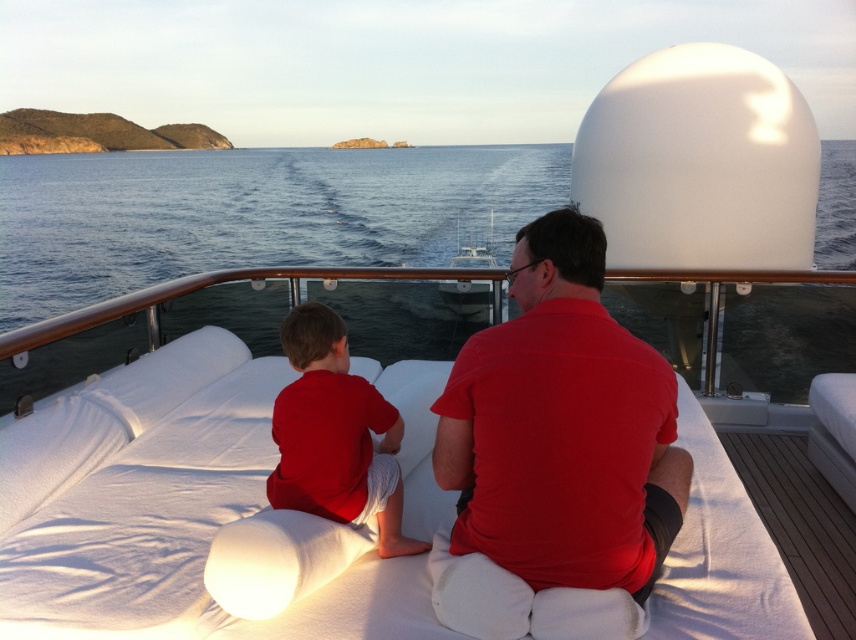
You are standing on the deck of the boat and want to take a photo. You notice two points marked on the deck at coordinates point (500, 616) and point (745, 445). Which point will appear larger in your photo?

Point (500, 616) is closer to the camera than point (745, 445), so it will appear larger in the photo.

You are standing on the boat deck and need to place a small backpack between the matte red shirt at center and the white wood deck at lower right. According to their positions, which object should the backpack be closer to?

The matte red shirt at center is positioned on the left side of white wood deck at lower right, so the backpack should be placed closer to the white wood deck at lower right to maintain the left alignment.